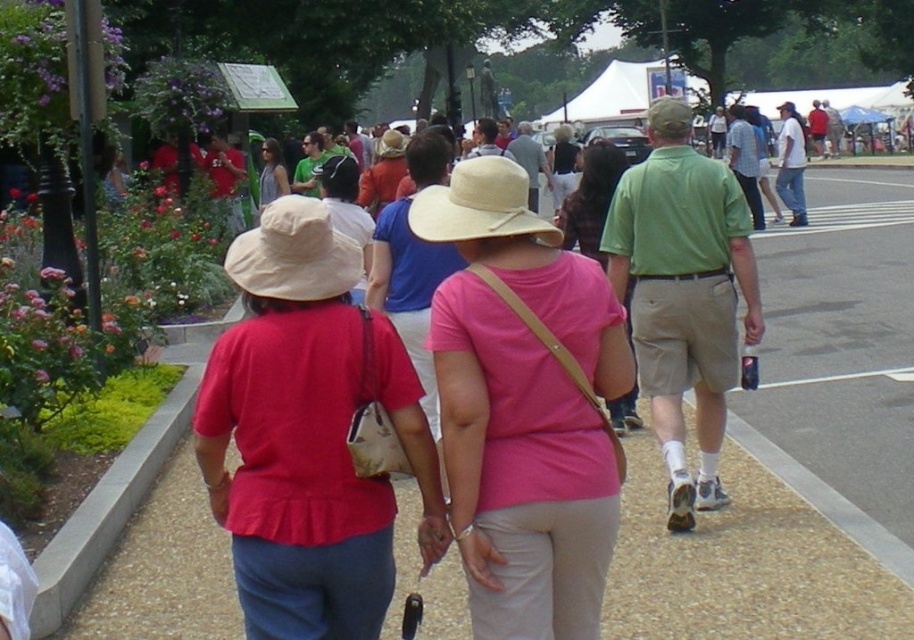
Question: Among these objects, which one is nearest to the camera?

Choices:
 (A) pink matte hat at center
 (B) matte gray tank top at center
 (C) matte red shirt at center

Answer: (C)

Question: Does pink matte hat at center have a greater width compared to matte red shirt at center?

Choices:
 (A) no
 (B) yes

Answer: (A)

Question: Which object is closer to the camera taking this photo?

Choices:
 (A) pink matte hat at center
 (B) pink fabric shirt at center
 (C) matte gray tank top at center
 (D) matte red shirt at center

Answer: (D)

Question: Which object appears farthest from the camera in this image?

Choices:
 (A) matte gray tank top at center
 (B) brown gravel path at center
 (C) matte red shirt at center

Answer: (A)

Question: Is pink fabric shirt at center wider than matte gray tank top at center?

Choices:
 (A) no
 (B) yes

Answer: (A)

Question: Is brown gravel path at center wider than pink fabric shirt at center?

Choices:
 (A) no
 (B) yes

Answer: (B)